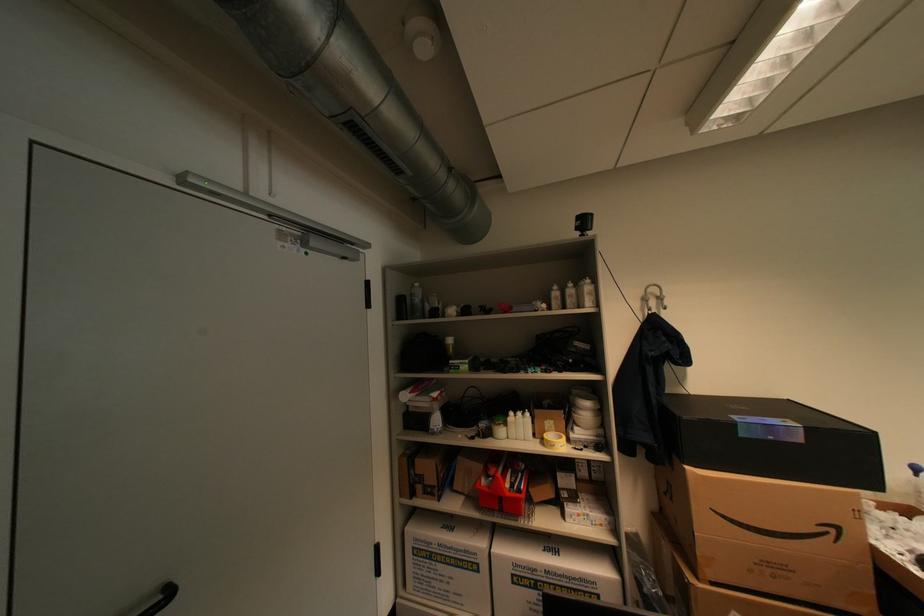
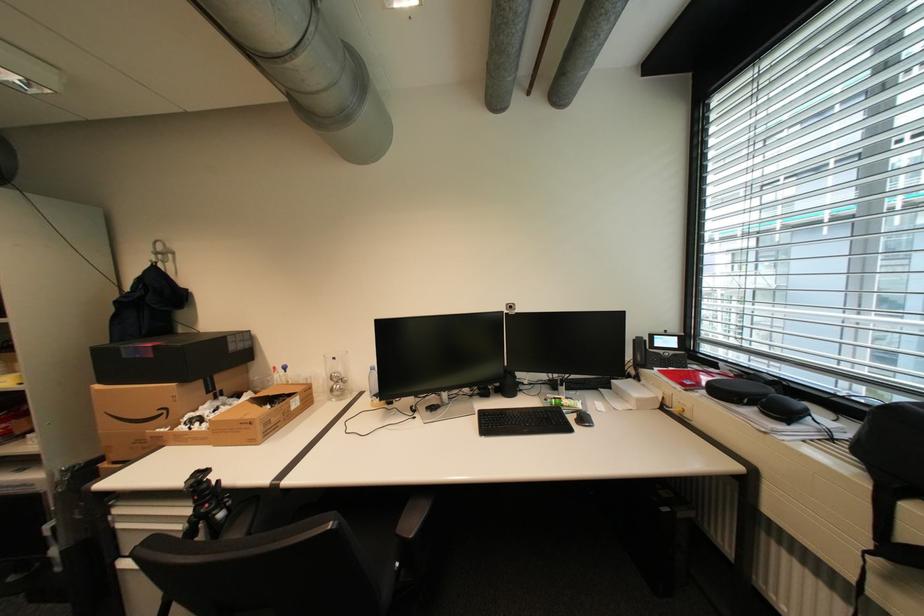
Find the pixel in the second image that matches point 841,531 in the first image.

(174, 411)